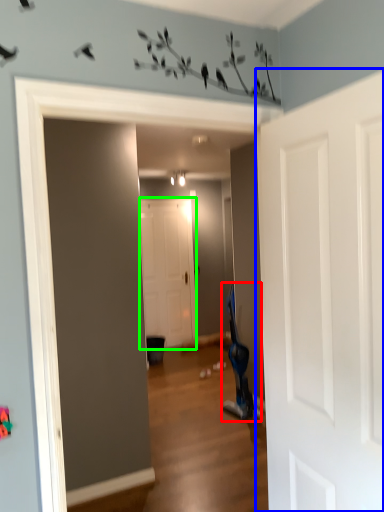
Question: Which object is positioned closest to swivel chair (highlighted by a red box)? Select from door (highlighted by a blue box) and door (highlighted by a green box).

Choices:
 (A) door
 (B) door

Answer: (B)